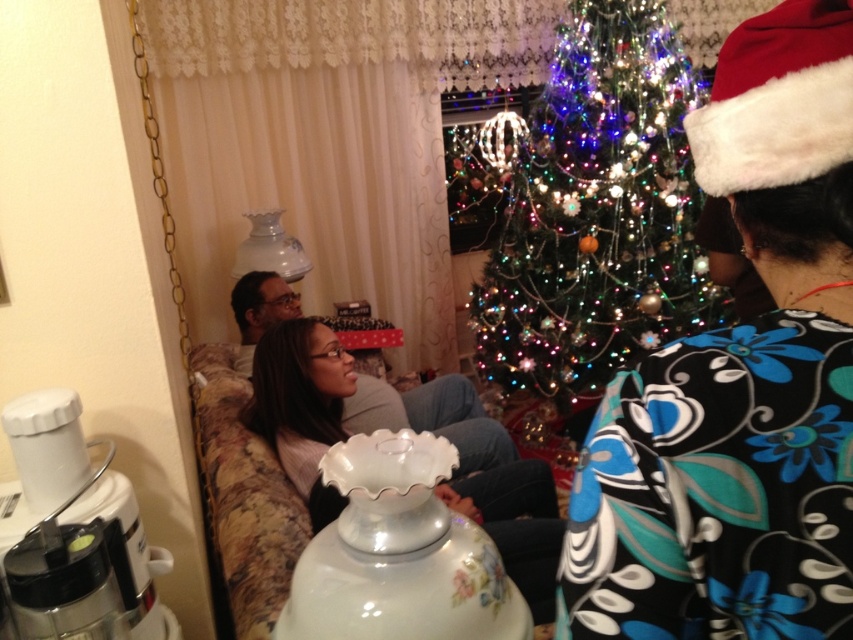
Can you confirm if matte white blender at lower left is positioned above floral-patterned fabric couch at center?

Yes, matte white blender at lower left is above floral-patterned fabric couch at center.

Is matte white blender at lower left below floral-patterned fabric couch at center?

No.

Where is `matte white blender at lower left`? matte white blender at lower left is located at coordinates (73, 532).

The height and width of the screenshot is (640, 853). In order to click on matte white blender at lower left in this screenshot , I will do `click(73, 532)`.

Which is in front, point (560, 372) or point (103, 628)?

Point (103, 628) is more forward.

Does iridescent glass christmas tree at center have a lesser width compared to matte white blender at lower left?

No, iridescent glass christmas tree at center is not thinner than matte white blender at lower left.

Is point (606, 120) behind point (33, 620)?

Yes, point (606, 120) is farther from viewer.

Locate an element on the screen. iridescent glass christmas tree at center is located at coordinates (590, 209).

Is black floral dress at center to the left of iridescent glass christmas tree at center from the viewer's perspective?

Yes, black floral dress at center is to the left of iridescent glass christmas tree at center.

Which is behind, point (778, 145) or point (578, 28)?

Point (578, 28)

The width and height of the screenshot is (853, 640). In order to click on black floral dress at center in this screenshot , I will do pos(740,381).